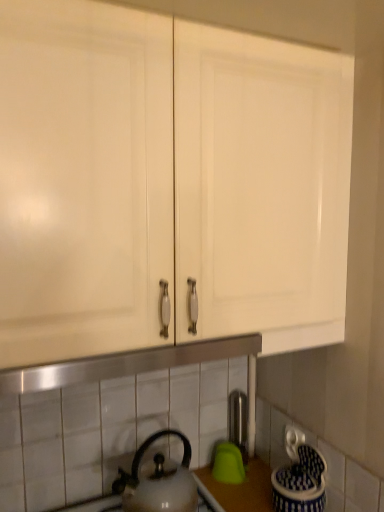
Question: Considering the relative sizes of satin nickel faucet at center and white glossy kettle at lower center in the image provided, is satin nickel faucet at center smaller than white glossy kettle at lower center?

Choices:
 (A) yes
 (B) no

Answer: (A)

Question: Does satin nickel faucet at center have a greater height compared to white glossy kettle at lower center?

Choices:
 (A) no
 (B) yes

Answer: (B)

Question: From the image's perspective, is satin nickel faucet at center on top of white glossy kettle at lower center?

Choices:
 (A) no
 (B) yes

Answer: (B)

Question: Considering the relative positions of satin nickel faucet at center and white glossy kettle at lower center in the image provided, is satin nickel faucet at center to the left of white glossy kettle at lower center from the viewer's perspective?

Choices:
 (A) yes
 (B) no

Answer: (B)

Question: From a real-world perspective, is satin nickel faucet at center beneath white glossy kettle at lower center?

Choices:
 (A) no
 (B) yes

Answer: (B)

Question: Would you say satin nickel faucet at center is a long distance from white glossy kettle at lower center?

Choices:
 (A) no
 (B) yes

Answer: (A)

Question: Would you say white glossy cabinet doors at upper center is a long distance from satin nickel faucet at center?

Choices:
 (A) yes
 (B) no

Answer: (B)

Question: Can you confirm if white glossy cabinet doors at upper center is positioned to the left of satin nickel faucet at center?

Choices:
 (A) yes
 (B) no

Answer: (A)

Question: Does white glossy cabinet doors at upper center turn towards satin nickel faucet at center?

Choices:
 (A) no
 (B) yes

Answer: (A)

Question: Can you confirm if white glossy cabinet doors at upper center is thinner than satin nickel faucet at center?

Choices:
 (A) no
 (B) yes

Answer: (A)

Question: Is white glossy cabinet doors at upper center outside of satin nickel faucet at center?

Choices:
 (A) yes
 (B) no

Answer: (A)

Question: Does white glossy cabinet doors at upper center have a smaller size compared to satin nickel faucet at center?

Choices:
 (A) yes
 (B) no

Answer: (B)

Question: From a real-world perspective, does white glossy kettle at lower center sit lower than satin nickel faucet at center?

Choices:
 (A) no
 (B) yes

Answer: (A)